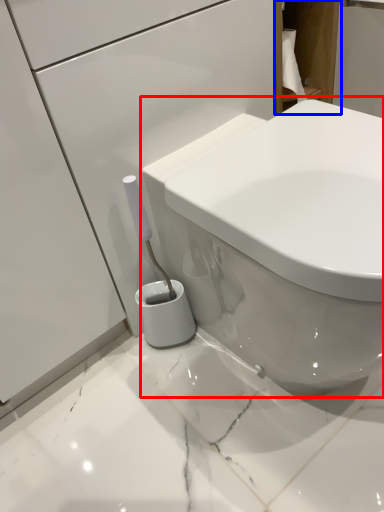
Question: Which object is further to the camera taking this photo, toilet (highlighted by a red box) or cabinetry (highlighted by a blue box)?

Choices:
 (A) toilet
 (B) cabinetry

Answer: (B)